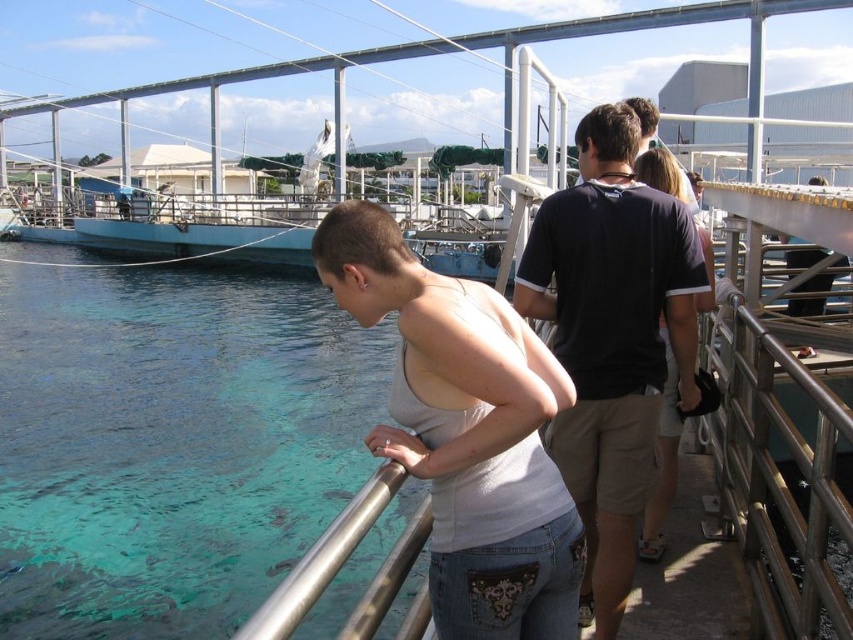
You are a photographer standing at the marina. You want to capture a photo of the black cotton shirt at center and the metallic silver railing at right. Which object is taller in the scene?

The black cotton shirt at center is much taller than the metallic silver railing at right.

You are standing at the railing in the marina scene. You want to find the clear blue water at lower left. According to the coordinates given, where exactly should you look?

The clear blue water at lower left is located at coordinates point (184, 452).

You are standing at the railing in the marina scene. You want to toss a small stone into the clear blue water at lower left. However, there is a person wearing the black cotton shirt at center between you and the water. Can you still reach the water without stepping around them?

The clear blue water at lower left is closer to the viewer than the black cotton shirt at center, so yes, you can reach the water without needing to step around the person in the black cotton shirt at center because the water is nearer to you.